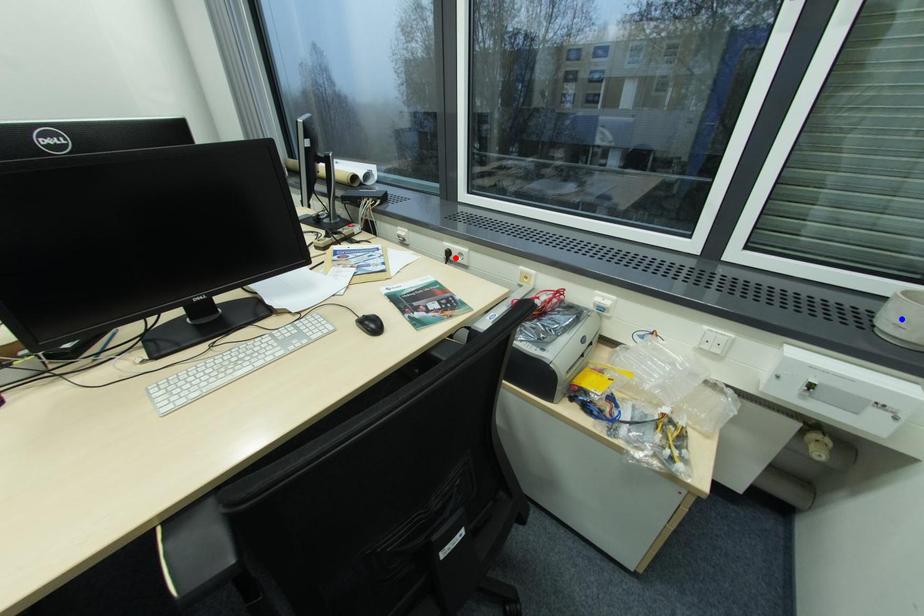
Question: In the image, two points are highlighted. Which point is nearer to the camera? Reply with the corresponding letter.

Choices:
 (A) blue point
 (B) red point

Answer: (A)